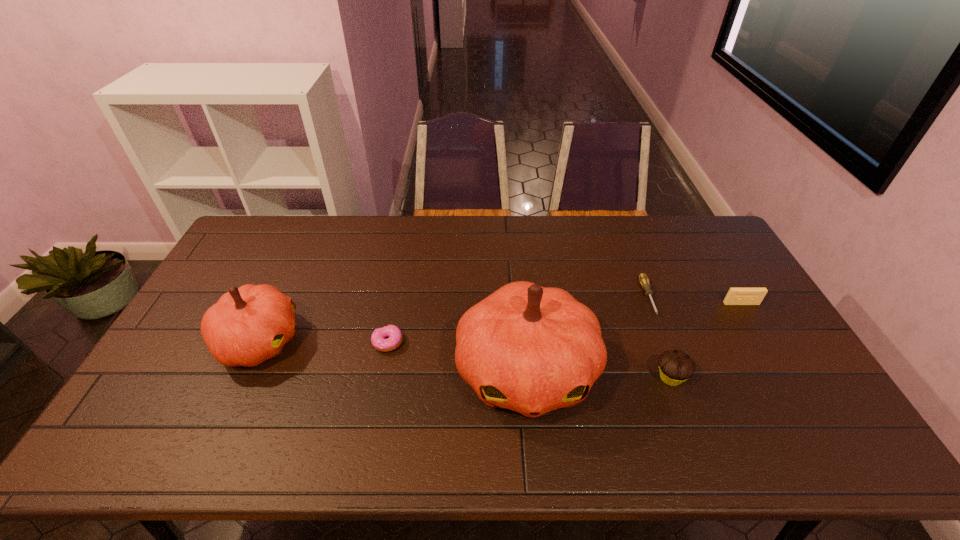
Please show where to add a pumpkin on the right while keeping spacing even. Please provide its 2D coordinates. Your answer should be formatted as a tuple, i.e. [(x, y)], where the tuple contains the x and y coordinates of a point satisfying the conditions above.

[(828, 406)]